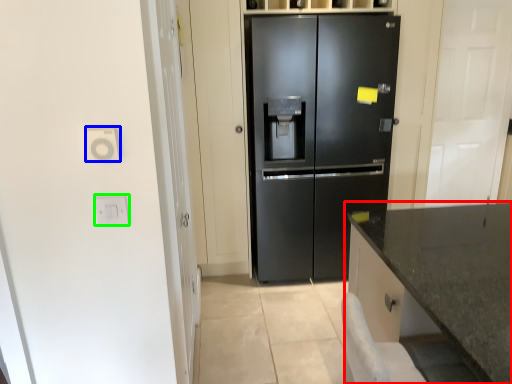
Question: Based on their relative distances, which object is nearer to countertop (highlighted by a red box)? Choose from electric outlet (highlighted by a blue box) and electric outlet (highlighted by a green box).

Choices:
 (A) electric outlet
 (B) electric outlet

Answer: (B)